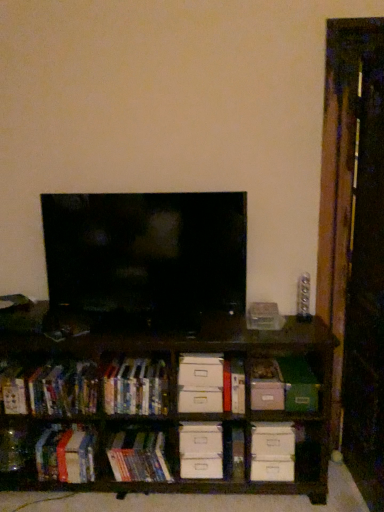
Question: Is the depth of hardcover book at lower left, which appears as the fourth book when viewed from the right, less than that of hardcover books at left, which is counted as the 3th book, starting from the right?

Choices:
 (A) no
 (B) yes

Answer: (A)

Question: Does hardcover book at lower left, the 2th book from the left, have a greater height compared to hardcover books at left, acting as the 3th book starting from the left?

Choices:
 (A) yes
 (B) no

Answer: (A)

Question: Is hardcover books at left, which is counted as the 3th book, starting from the right, located within hardcover book at lower left, the 2th book from the left?

Choices:
 (A) yes
 (B) no

Answer: (B)

Question: From the image's perspective, does hardcover book at lower left, which appears as the fourth book when viewed from the right, appear lower than hardcover books at left, acting as the 3th book starting from the left?

Choices:
 (A) no
 (B) yes

Answer: (B)

Question: Considering the relative positions of hardcover book at lower left, which appears as the fourth book when viewed from the right, and hardcover books at left, acting as the 3th book starting from the left, in the image provided, is hardcover book at lower left, which appears as the fourth book when viewed from the right, to the right of hardcover books at left, acting as the 3th book starting from the left, from the viewer's perspective?

Choices:
 (A) no
 (B) yes

Answer: (A)

Question: From a real-world perspective, is hardcover book at lower left, which appears as the fourth book when viewed from the right, physically above hardcover books at left, which is counted as the 3th book, starting from the right?

Choices:
 (A) no
 (B) yes

Answer: (A)

Question: Can you confirm if hardcover books at left, which is counted as the 3th book, starting from the right, is smaller than hardcover book at lower left, arranged as the first book when viewed from the left?

Choices:
 (A) yes
 (B) no

Answer: (B)

Question: Is hardcover books at left, which is counted as the 3th book, starting from the right, not within hardcover book at lower left, arranged as the first book when viewed from the left?

Choices:
 (A) no
 (B) yes

Answer: (B)

Question: Considering the relative sizes of hardcover books at left, which is counted as the 3th book, starting from the right, and hardcover book at lower left, arranged as the first book when viewed from the left, in the image provided, is hardcover books at left, which is counted as the 3th book, starting from the right, thinner than hardcover book at lower left, arranged as the first book when viewed from the left,?

Choices:
 (A) no
 (B) yes

Answer: (A)

Question: Would you say hardcover books at left, which is counted as the 3th book, starting from the right, contains hardcover book at lower left, arranged as the first book when viewed from the left?

Choices:
 (A) yes
 (B) no

Answer: (B)

Question: Is hardcover books at left, acting as the 3th book starting from the left, oriented towards hardcover book at lower left, arranged as the first book when viewed from the left?

Choices:
 (A) no
 (B) yes

Answer: (A)

Question: Considering the relative positions of hardcover books at left, acting as the 3th book starting from the left, and hardcover book at lower left, the 5th book from the right, in the image provided, is hardcover books at left, acting as the 3th book starting from the left, to the right of hardcover book at lower left, the 5th book from the right, from the viewer's perspective?

Choices:
 (A) no
 (B) yes

Answer: (B)

Question: Can you confirm if hardcover books at left, which is counted as the 3th book, starting from the right, is smaller than transparent glass door at right?

Choices:
 (A) yes
 (B) no

Answer: (A)